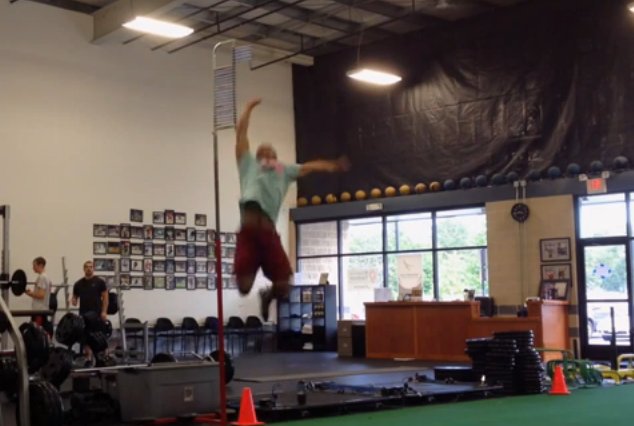
This screenshot has width=634, height=426. Identify the location of black shelf with equipment, small. (330, 309).